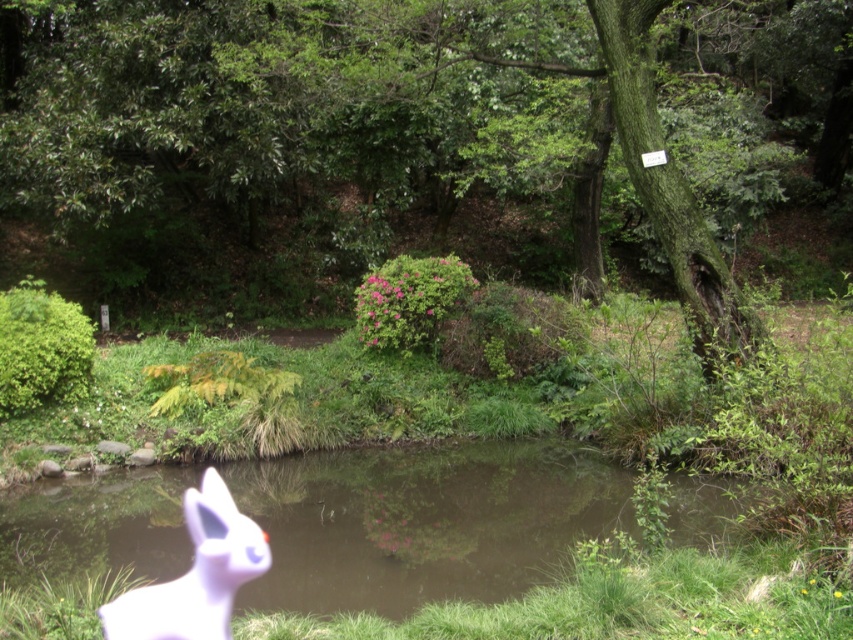
Question: Which point is farther to the camera?

Choices:
 (A) purple matte rabbit at lower left
 (B) transparent water at pond center

Answer: (B)

Question: Can you confirm if transparent water at pond center is positioned to the left of purple matte rabbit at lower left?

Choices:
 (A) yes
 (B) no

Answer: (A)

Question: From the image, what is the correct spatial relationship of transparent water at pond center in relation to purple matte rabbit at lower left?

Choices:
 (A) right
 (B) left

Answer: (B)

Question: Is transparent water at pond center in front of purple matte rabbit at lower left?

Choices:
 (A) no
 (B) yes

Answer: (A)